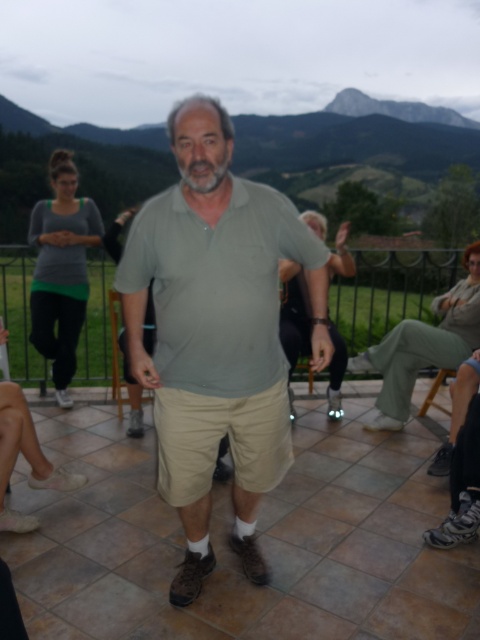
Question: Is rocky gray mountain at upper center below khaki pants at lower right?

Choices:
 (A) yes
 (B) no

Answer: (B)

Question: Can you confirm if rocky gray mountain at upper center is positioned below khaki pants at lower right?

Choices:
 (A) no
 (B) yes

Answer: (A)

Question: Which of the following is the farthest from the observer?

Choices:
 (A) rocky gray mountain at upper center
 (B) khaki pants at lower right
 (C) matte green shirt at center

Answer: (A)

Question: Among these points, which one is nearest to the camera?

Choices:
 (A) (310, 195)
 (B) (468, 250)

Answer: (B)

Question: Which of the following is the farthest from the observer?

Choices:
 (A) (451, 353)
 (B) (207, 294)

Answer: (A)

Question: Is rocky gray mountain at upper center smaller than khaki pants at lower right?

Choices:
 (A) no
 (B) yes

Answer: (A)